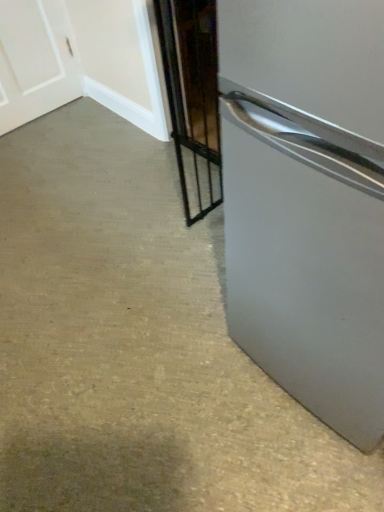
Locate an element on the screen. The height and width of the screenshot is (512, 384). vacant area to the left of black metal screen door at center is located at coordinates tap(164, 234).